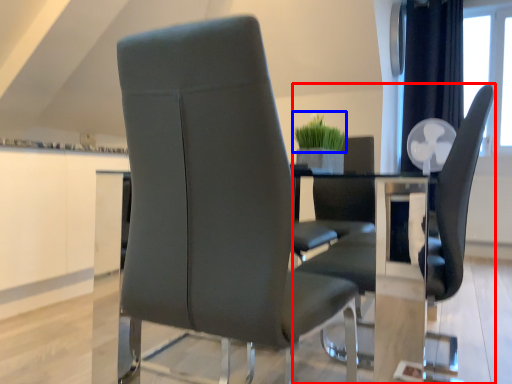
Question: Which object is further to the camera taking this photo, chair (highlighted by a red box) or plant (highlighted by a blue box)?

Choices:
 (A) chair
 (B) plant

Answer: (B)